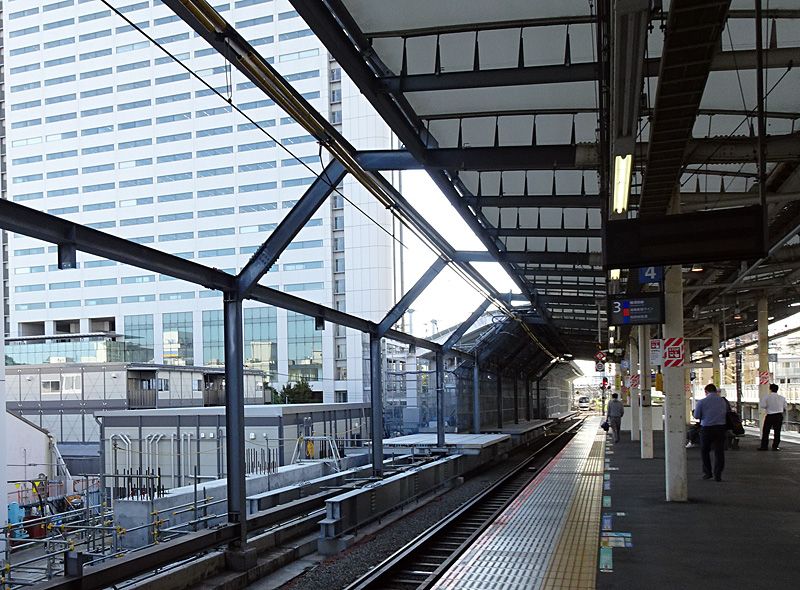
Where is `columns`? columns is located at coordinates (674, 417), (642, 421), (632, 399), (764, 355), (717, 365).